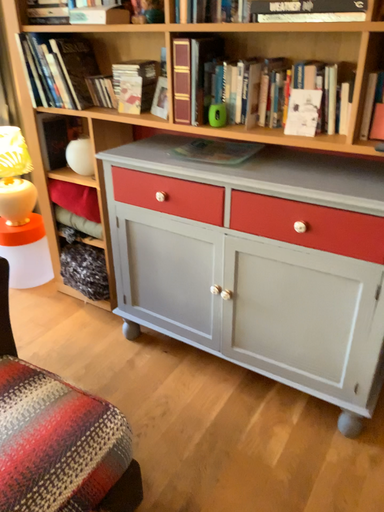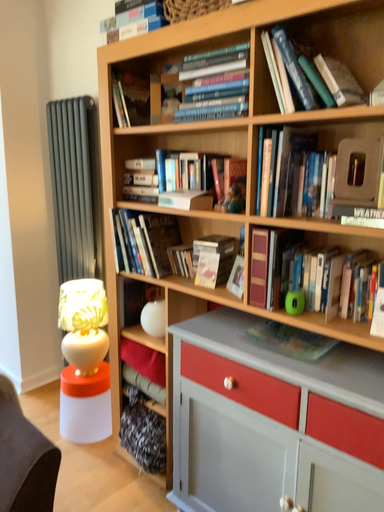
Question: How did the camera likely rotate when shooting the video?

Choices:
 (A) rotated left
 (B) rotated right

Answer: (A)